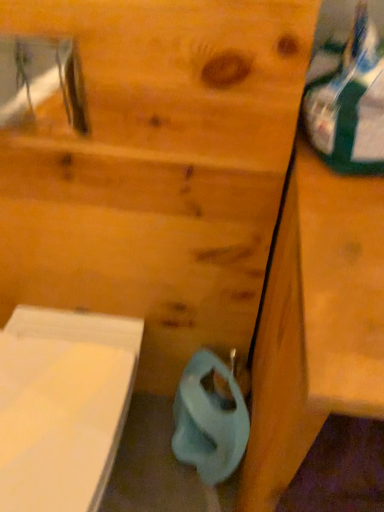
In order to face blue matte toilet paper at lower center, should I rotate leftwards or rightwards?

To align with it, rotate right about 1.722°.

Image resolution: width=384 pixels, height=512 pixels. In order to click on blue matte toilet paper at lower center in this screenshot , I will do `click(209, 420)`.

Measure the distance between point (186, 406) and camera.

They are 1.09 meters apart.

What do you see at coordinates (209, 420) in the screenshot?
I see `blue matte toilet paper at lower center` at bounding box center [209, 420].

Image resolution: width=384 pixels, height=512 pixels. What do you see at coordinates (313, 322) in the screenshot? I see `wooden vanity at right` at bounding box center [313, 322].

Identify the location of wooden vanity at right. Image resolution: width=384 pixels, height=512 pixels. (313, 322).

Locate an element on the screen. The width and height of the screenshot is (384, 512). blue matte toilet paper at lower center is located at coordinates (209, 420).

Is blue matte toilet paper at lower center to the left or to the right of wooden vanity at right in the image?

In the image, blue matte toilet paper at lower center appears on the left side of wooden vanity at right.

Which is behind, blue matte toilet paper at lower center or wooden vanity at right?

blue matte toilet paper at lower center is behind.

Is point (195, 391) farther from camera compared to point (278, 350)?

Yes, it is.

Based on the photo, from the image's perspective, which is below, blue matte toilet paper at lower center or wooden vanity at right?

blue matte toilet paper at lower center, from the image's perspective.

From a real-world perspective, who is located higher, blue matte toilet paper at lower center or wooden vanity at right?

In real-world perspective, wooden vanity at right is above.

Consider the image. Which object is thinner, blue matte toilet paper at lower center or wooden vanity at right?

With smaller width is blue matte toilet paper at lower center.

Is blue matte toilet paper at lower center taller than wooden vanity at right?

In fact, blue matte toilet paper at lower center may be shorter than wooden vanity at right.

Is blue matte toilet paper at lower center smaller than wooden vanity at right?

Indeed, blue matte toilet paper at lower center has a smaller size compared to wooden vanity at right.

Is blue matte toilet paper at lower center outside of wooden vanity at right?

Yes, blue matte toilet paper at lower center is outside of wooden vanity at right.

Is blue matte toilet paper at lower center in contact with wooden vanity at right?

No, blue matte toilet paper at lower center is not next to wooden vanity at right.

Is blue matte toilet paper at lower center facing towards wooden vanity at right?

No, blue matte toilet paper at lower center is not turned towards wooden vanity at right.

In the scene shown: How different are the orientations of blue matte toilet paper at lower center and wooden vanity at right in degrees?

0.476 degrees separate the facing orientations of blue matte toilet paper at lower center and wooden vanity at right.

I want to click on toilet paper behind the wooden vanity at right, so click(x=209, y=420).

Between wooden vanity at right and blue matte toilet paper at lower center, which one appears on the left side from the viewer's perspective?

blue matte toilet paper at lower center is more to the left.

Relative to blue matte toilet paper at lower center, is wooden vanity at right in front or behind?

Visually, wooden vanity at right is located in front of blue matte toilet paper at lower center.

Is point (296, 174) in front of point (184, 451)?

Yes, it is in front of point (184, 451).

From the image's perspective, between wooden vanity at right and blue matte toilet paper at lower center, who is located below?

blue matte toilet paper at lower center.

From a real-world perspective, is wooden vanity at right positioned over blue matte toilet paper at lower center based on gravity?

Yes, from a real-world perspective, wooden vanity at right is on top of blue matte toilet paper at lower center.

Considering the sizes of wooden vanity at right and blue matte toilet paper at lower center in the image, is wooden vanity at right wider or thinner than blue matte toilet paper at lower center?

In the image, wooden vanity at right appears to be wider than blue matte toilet paper at lower center.

Does wooden vanity at right have a greater height compared to blue matte toilet paper at lower center?

Indeed, wooden vanity at right has a greater height compared to blue matte toilet paper at lower center.

Can you confirm if wooden vanity at right is smaller than blue matte toilet paper at lower center?

No.

Is wooden vanity at right positioned beyond the bounds of blue matte toilet paper at lower center?

wooden vanity at right lies outside blue matte toilet paper at lower center's area.

Is wooden vanity at right far away from blue matte toilet paper at lower center?

They are positioned close to each other.

Looking at this image, does wooden vanity at right turn towards blue matte toilet paper at lower center?

No, wooden vanity at right is not oriented towards blue matte toilet paper at lower center.

Consider the image. How many degrees apart are the facing directions of wooden vanity at right and blue matte toilet paper at lower center?

There is a 0.476-degree angle between the facing directions of wooden vanity at right and blue matte toilet paper at lower center.

The width and height of the screenshot is (384, 512). In order to click on toilet paper on the left of wooden vanity at right in this screenshot , I will do `click(209, 420)`.

Find the location of a particular element. toilet paper beneath the wooden vanity at right (from a real-world perspective) is located at coordinates (209, 420).

You are a GUI agent. You are given a task and a screenshot of the screen. Output one action in this format:
    pyautogui.click(x=<x>, y=<y>)
    Task: Click on the vanity located on the right of blue matte toilet paper at lower center
    This screenshot has width=384, height=512.
    Given the screenshot: What is the action you would take?
    (x=313, y=322)